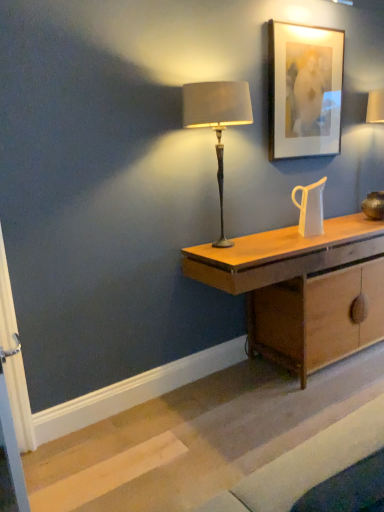
Question: Looking at their shapes, would you say transparent glass jug at center is wider or thinner than matte wooden picture frame at upper right?

Choices:
 (A) thin
 (B) wide

Answer: (B)

Question: From a real-world perspective, is transparent glass jug at center positioned above or below matte wooden picture frame at upper right?

Choices:
 (A) above
 (B) below

Answer: (B)

Question: Which object is the farthest from the matte beige fabric lampshade at center?

Choices:
 (A) matte wooden picture frame at upper right
 (B) wooden desk at center
 (C) transparent glass jug at center

Answer: (A)

Question: Based on their relative distances, which object is farther from the matte beige fabric lampshade at center?

Choices:
 (A) transparent glass jug at center
 (B) wooden desk at center
 (C) matte wooden picture frame at upper right

Answer: (C)